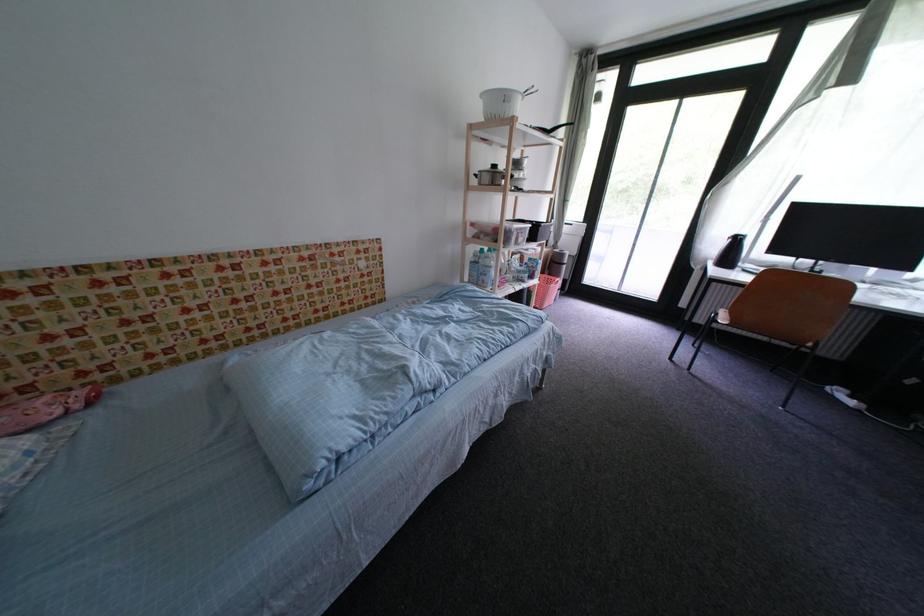
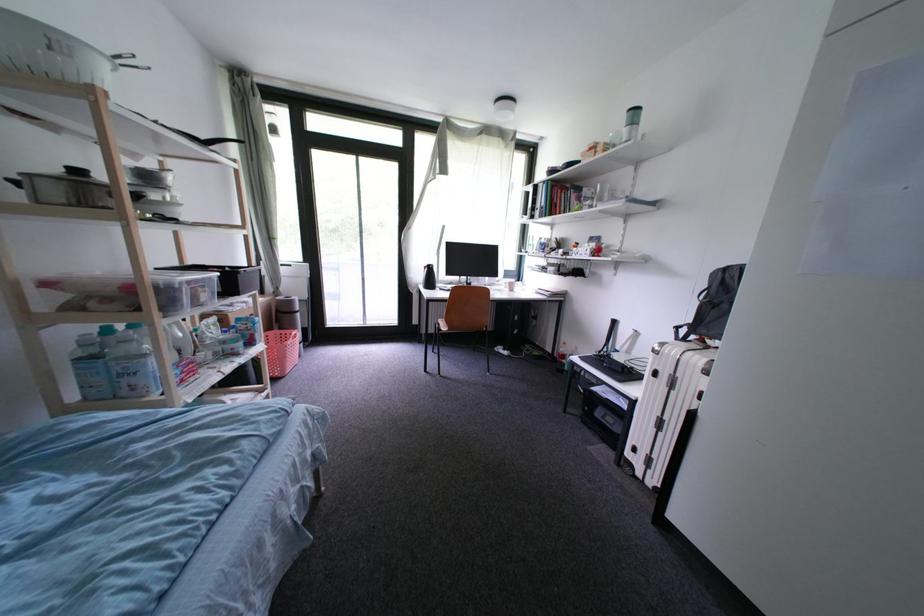
Question: The images are taken continuously from a first-person perspective. In which direction is your viewpoint rotating?

Choices:
 (A) Left
 (B) Right
 (C) Up
 (D) Down

Answer: (B)